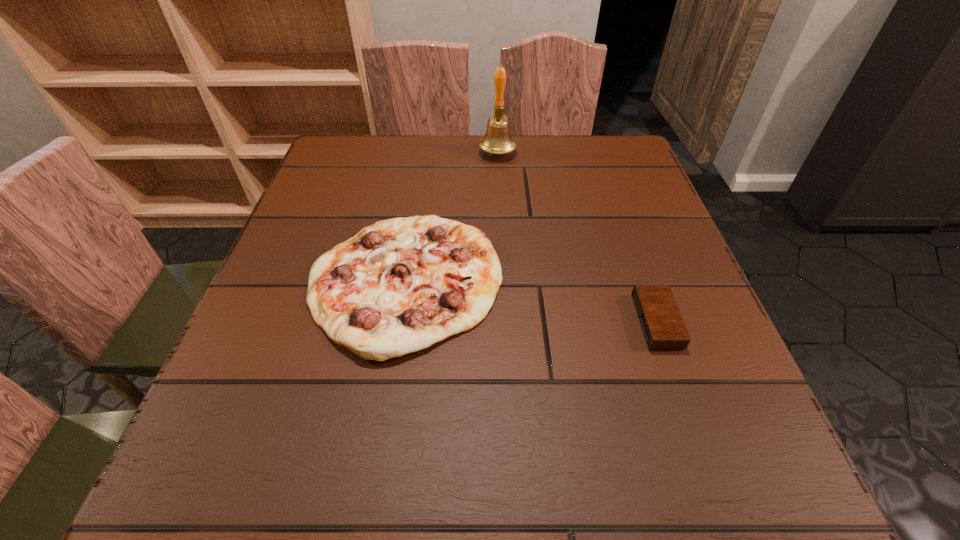
What are the coordinates of `object situated at the far edge` in the screenshot? It's located at (497, 140).

Where is `object present at the left edge`? The height and width of the screenshot is (540, 960). object present at the left edge is located at coordinates (398, 286).

You are a GUI agent. You are given a task and a screenshot of the screen. Output one action in this format:
    pyautogui.click(x=<x>, y=<y>)
    Task: Click on the object situated at the right edge
    This screenshot has width=960, height=540.
    Given the screenshot: What is the action you would take?
    pyautogui.click(x=663, y=327)

The image size is (960, 540). I want to click on vacant space at the far edge, so click(411, 162).

I want to click on vacant point at the near edge, so click(x=395, y=458).

In the image, there is a desktop. Where is `free space at the left edge`? This screenshot has height=540, width=960. free space at the left edge is located at coordinates (345, 193).

Locate an element on the screen. The width and height of the screenshot is (960, 540). vacant space at the right edge of the desktop is located at coordinates (640, 335).

Identify the location of vacant space at the far left corner of the desktop. This screenshot has width=960, height=540. (353, 169).

Identify the location of vacant space at the far right corner of the desktop. (581, 185).

In the image, there is a desktop. Identify the location of vacant space at the near right corner. [686, 461].